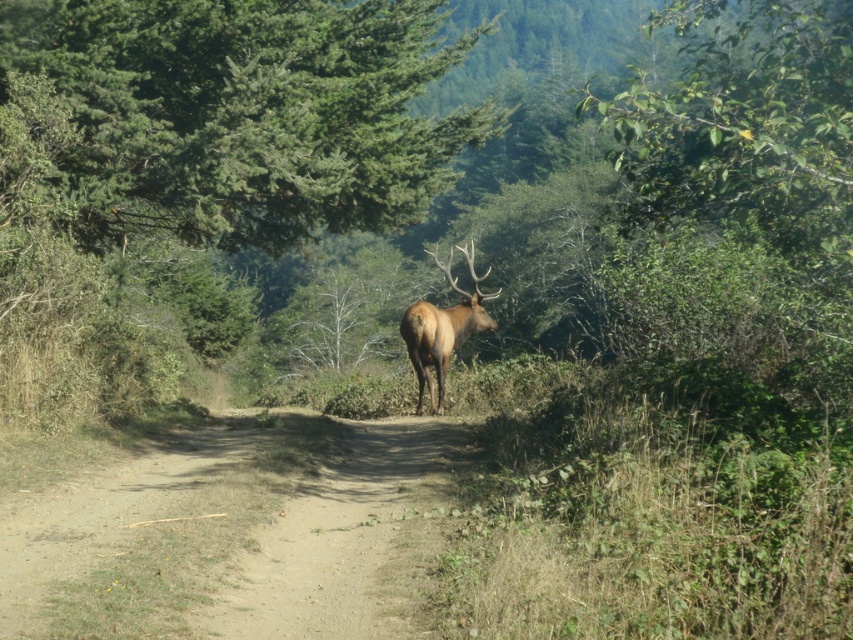
Between green needle-like leaves at upper left and dirt path at center, which one is positioned lower?

dirt path at center

Which is behind, point (312, 154) or point (410, 417)?

The point (410, 417) is more distant.

Identify the location of green needle-like leaves at upper left. This screenshot has height=640, width=853. (245, 113).

Does dirt path at center have a lesser width compared to brown velvet deer at center?

No.

Is dirt path at center positioned behind brown velvet deer at center?

No, it is not.

Measure the distance between dirt path at center and camera.

dirt path at center is 17.98 feet from camera.

Where is `dirt path at center`? This screenshot has width=853, height=640. dirt path at center is located at coordinates (236, 532).

Is green needle-like leaves at upper left thinner than brown velvet deer at center?

Incorrect, green needle-like leaves at upper left's width is not less than brown velvet deer at center's.

Does green needle-like leaves at upper left appear over brown velvet deer at center?

Indeed, green needle-like leaves at upper left is positioned over brown velvet deer at center.

The image size is (853, 640). What do you see at coordinates (245, 113) in the screenshot? I see `green needle-like leaves at upper left` at bounding box center [245, 113].

This screenshot has height=640, width=853. I want to click on green needle-like leaves at upper left, so click(x=245, y=113).